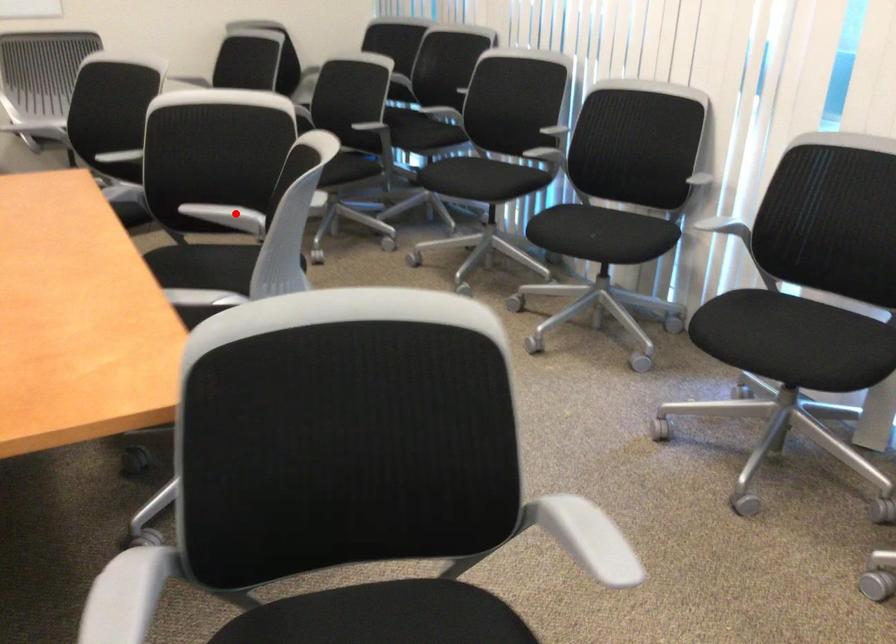
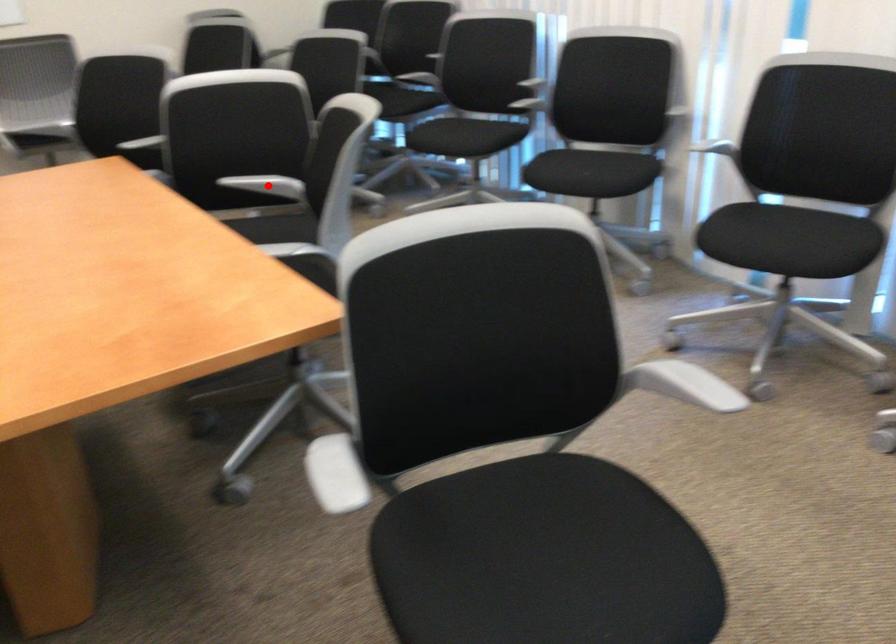
I am providing you with two images of the same scene from different viewpoints. A red point is marked on the first image and another point is marked on the second image. Is the marked point in image1 the same physical position as the marked point in image2?

Yes